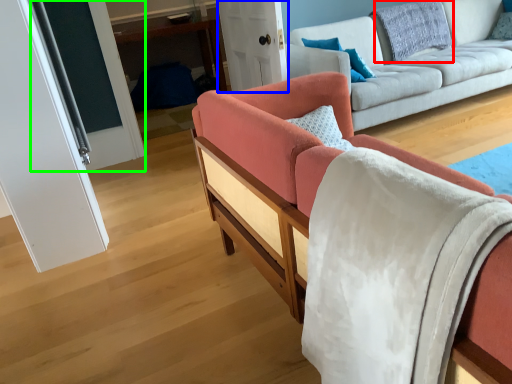
Question: Which object is the farthest from pillow (highlighted by a red box)? Choose among these: glass door (highlighted by a blue box) or glass door (highlighted by a green box).

Choices:
 (A) glass door
 (B) glass door

Answer: (B)